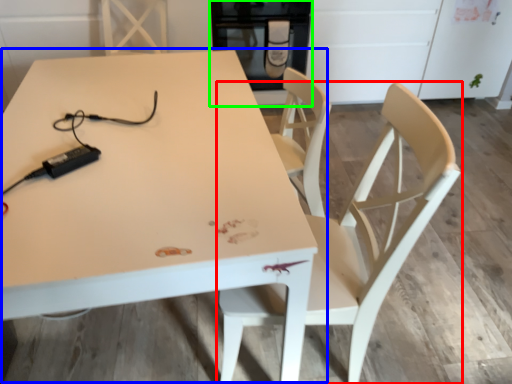
Question: Estimate the real-world distances between objects in this image. Which object is closer to chair (highlighted by a red box), table (highlighted by a blue box) or appliance (highlighted by a green box)?

Choices:
 (A) table
 (B) appliance

Answer: (A)